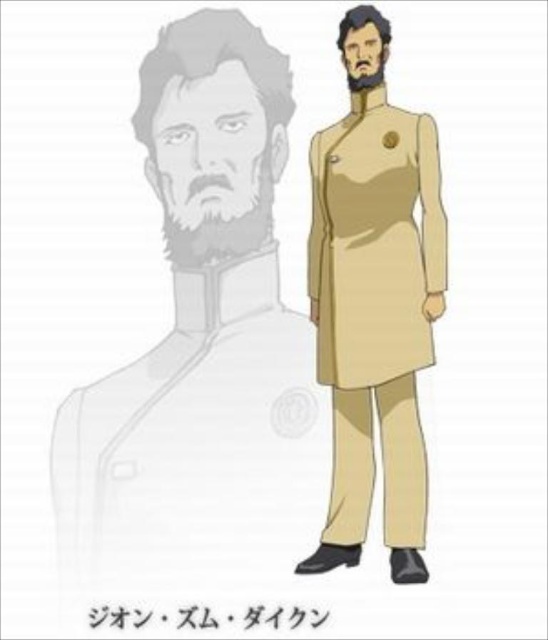
The beige fabric coat at center is part of the main character. There is also a faint silhouette of the character behind them. How far apart are the main character and the silhouette?

The beige fabric coat at center and the faint silhouette behind them are 2.49 meters apart.

You are an animator working on a character design. You have two coats to choose from for the character in the scene described. The first is the beige fabric coat at center, and the second is the beige matte trench coat at center. Which coat would you select if you want the character to appear more imposing in the frame?

The beige fabric coat at center is larger in size than the beige matte trench coat at center, so selecting the beige fabric coat at center would make the character appear more imposing due to its larger size.